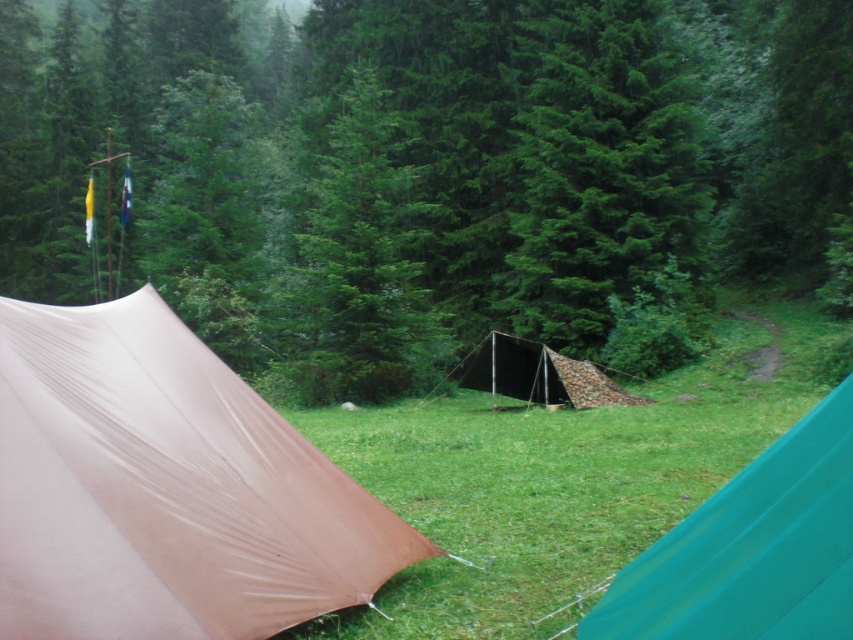
You are a hiker trying to reach the camo fabric tent at center from the green matte tree at upper center. Which direction should you move relative to the tree?

Since the green matte tree at upper center is closer to you than the camo fabric tent at center, you should move away from the green matte tree at upper center to reach the camo fabric tent at center.

You are setting up a picnic blanket in the middle of the green grass at center and camo fabric tent at center. Which area has enough space to accommodate a 3 meter wide picnic blanket without overlapping anything?

The green grass at center has a width that surpasses the camo fabric tent at center, so placing the 3 meter wide picnic blanket on the green grass at center would provide sufficient space without overlapping anything.

You are a hiker who wants to set up a campfire near the green grass at center and the camo fabric tent at center. Based on their positions, where should you place the campfire to avoid the tent?

The green grass at center is below the camo fabric tent at center, so you should place the campfire on the ground near the green grass at center but away from the base of the camo fabric tent at center to avoid fire hazards.